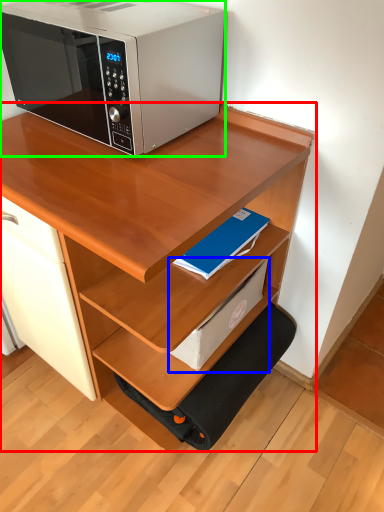
Question: Which is farther away from desk (highlighted by a red box)? paperback book (highlighted by a blue box) or microwave oven (highlighted by a green box)?

Choices:
 (A) paperback book
 (B) microwave oven

Answer: (B)